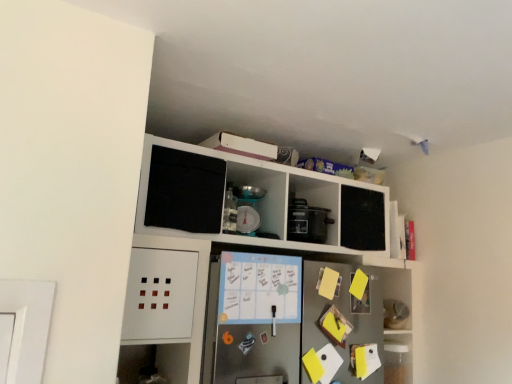
Question: Is matte black rice cooker at center surrounded by metallic scale at upper center?

Choices:
 (A) no
 (B) yes

Answer: (A)

Question: Is metallic scale at upper center thinner than matte black rice cooker at center?

Choices:
 (A) no
 (B) yes

Answer: (B)

Question: Would you consider metallic scale at upper center to be distant from matte black rice cooker at center?

Choices:
 (A) yes
 (B) no

Answer: (B)

Question: Is metallic scale at upper center to the right of matte black rice cooker at center from the viewer's perspective?

Choices:
 (A) yes
 (B) no

Answer: (B)

Question: Does metallic scale at upper center appear on the left side of matte black rice cooker at center?

Choices:
 (A) no
 (B) yes

Answer: (B)

Question: Is point (290, 201) closer or farther from the camera than point (241, 253)?

Choices:
 (A) farther
 (B) closer

Answer: (A)

Question: Is matte black rice cooker at center bigger or smaller than white matte cabinet at upper center?

Choices:
 (A) small
 (B) big

Answer: (A)

Question: Relative to white matte cabinet at upper center, is matte black rice cooker at center in front or behind?

Choices:
 (A) behind
 (B) front

Answer: (A)

Question: Choose the correct answer: Is matte black rice cooker at center inside white matte cabinet at upper center or outside it?

Choices:
 (A) inside
 (B) outside

Answer: (A)

Question: Considering the relative positions of metallic scale at upper center and matte black rice cooker at center in the image provided, is metallic scale at upper center to the left or to the right of matte black rice cooker at center?

Choices:
 (A) left
 (B) right

Answer: (A)

Question: From the image's perspective, relative to matte black rice cooker at center, is metallic scale at upper center above or below?

Choices:
 (A) above
 (B) below

Answer: (A)

Question: From a real-world perspective, is metallic scale at upper center physically located above or below matte black rice cooker at center?

Choices:
 (A) below
 (B) above

Answer: (B)

Question: Considering the positions of point (262, 208) and point (293, 208), is point (262, 208) closer or farther from the camera than point (293, 208)?

Choices:
 (A) farther
 (B) closer

Answer: (A)

Question: Which is correct: matte black rice cooker at center is inside metallic scale at upper center, or outside of it?

Choices:
 (A) outside
 (B) inside

Answer: (A)

Question: Is matte black rice cooker at center in front of or behind metallic scale at upper center in the image?

Choices:
 (A) front
 (B) behind

Answer: (B)